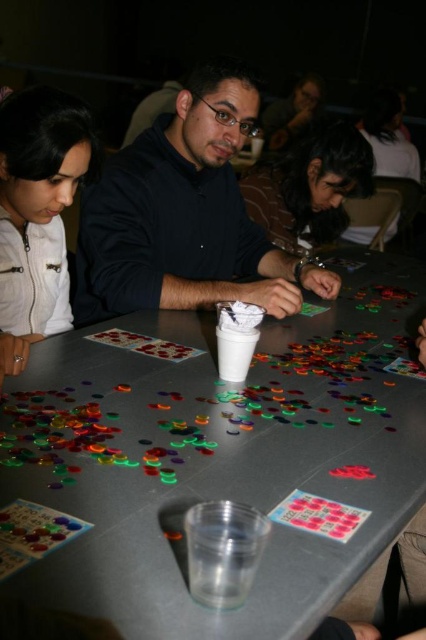
Question: Which point is farther from the camera taking this photo?

Choices:
 (A) (43, 268)
 (B) (258, 291)
 (C) (206, 400)
 (D) (316, 163)

Answer: (D)

Question: Is matte black shirt at center bigger than dark brown hair at center?

Choices:
 (A) no
 (B) yes

Answer: (B)

Question: Does matte black shirt at center have a larger size compared to matte white jacket at upper left?

Choices:
 (A) no
 (B) yes

Answer: (B)

Question: Which object is closer to the camera taking this photo?

Choices:
 (A) matte black shirt at center
 (B) translucent plastic table at center
 (C) matte white jacket at upper left

Answer: (B)

Question: Which object is the farthest from the matte white jacket at upper left?

Choices:
 (A) translucent plastic table at center
 (B) dark brown hair at center
 (C) matte black shirt at center

Answer: (B)

Question: Is matte white jacket at upper left above dark brown hair at center?

Choices:
 (A) no
 (B) yes

Answer: (A)